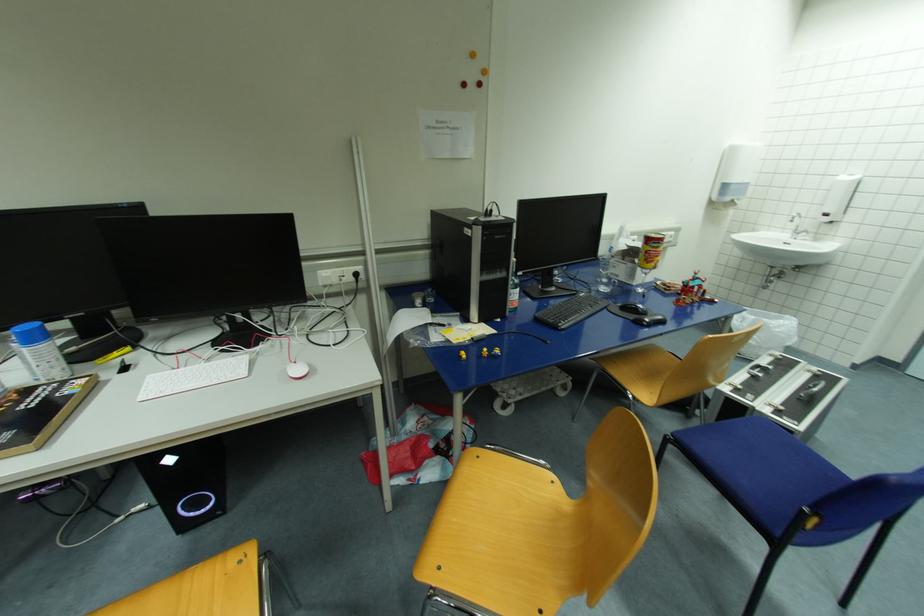
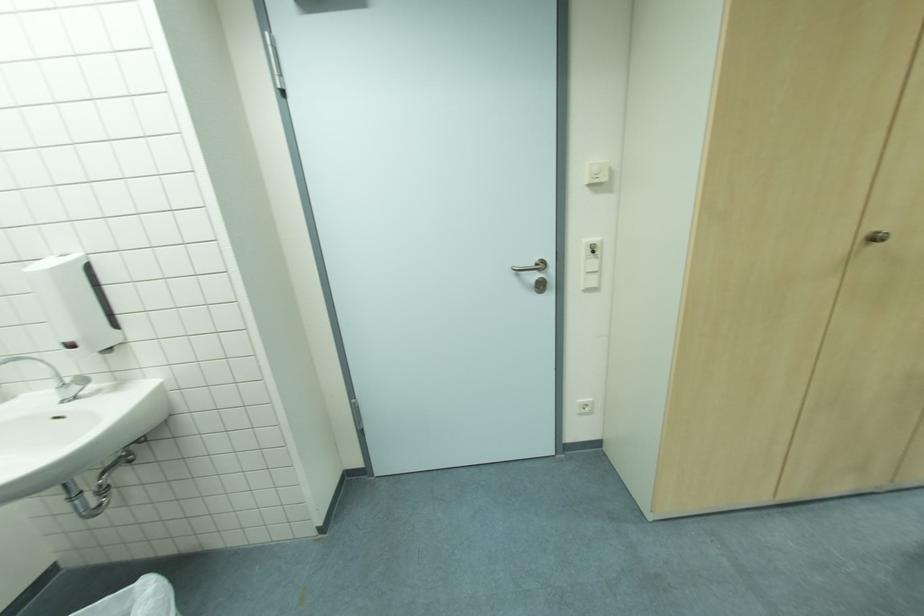
Find the pixel in the second image that matches pixel 831 213 in the first image.

(71, 341)